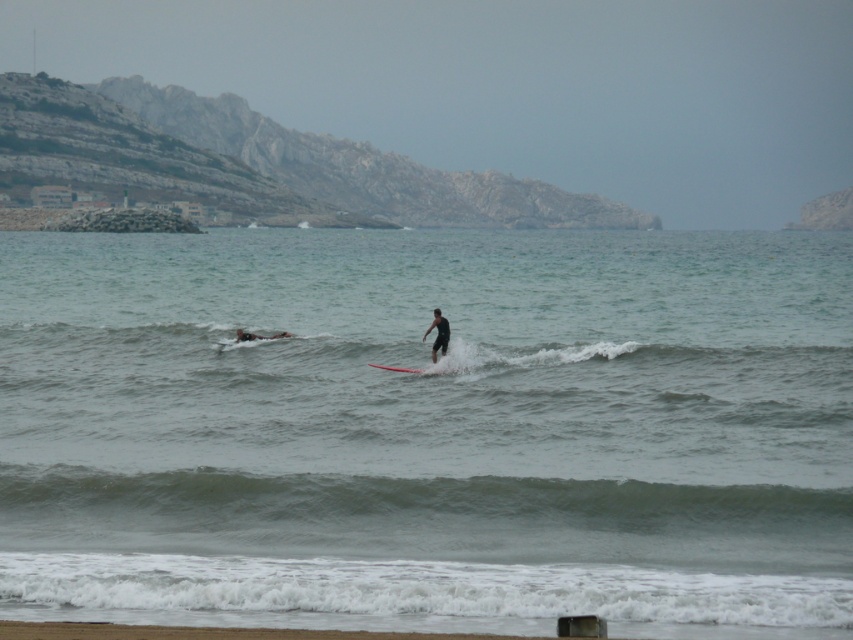
Question: Can you confirm if black matte surfboard at center is positioned below smooth red surfboard at center?

Choices:
 (A) no
 (B) yes

Answer: (A)

Question: Estimate the real-world distances between objects in this image. Which object is farther from the smooth black surfboard at center?

Choices:
 (A) clear water at surfboard center
 (B) black matte surfboard at center
 (C) smooth sand beach at lower center
 (D) smooth red surfboard at center

Answer: (A)

Question: Considering the real-world distances, which object is closest to the smooth black surfboard at center?

Choices:
 (A) smooth sand beach at lower center
 (B) black matte surfboard at center
 (C) smooth red surfboard at center

Answer: (C)

Question: Which object is closer to the camera taking this photo?

Choices:
 (A) black matte surfboard at center
 (B) smooth black surfboard at center
 (C) clear water at surfboard center

Answer: (C)

Question: Does smooth sand beach at lower center have a larger size compared to black matte surfboard at center?

Choices:
 (A) no
 (B) yes

Answer: (B)

Question: Is black matte surfboard at center bigger than smooth black surfboard at center?

Choices:
 (A) yes
 (B) no

Answer: (A)